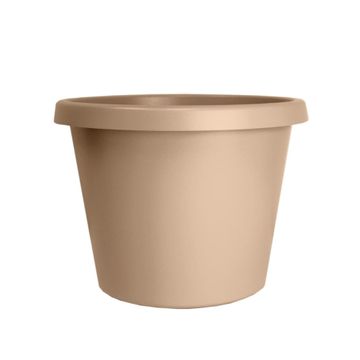
What are the coordinates of `pot` in the screenshot? It's located at (179, 267).